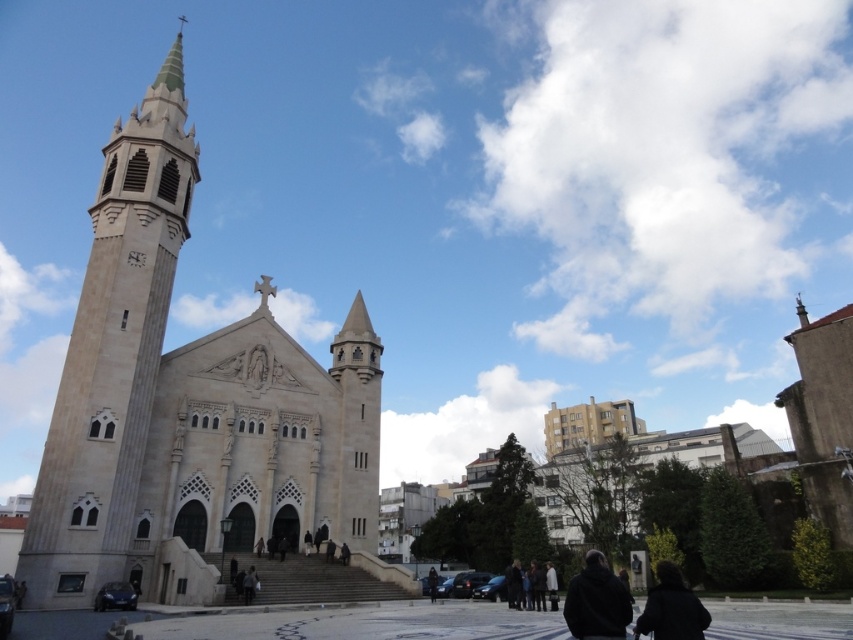
You are a photographer standing in front of the beige stone church at left and the black matte jacket at lower center. Which object would appear closer to you in the photo?

The black matte jacket at lower center would appear closer to you in the photo because it is smaller in size compared to the beige stone church at left, which is larger and likely farther away.

You are standing at the point marked as point (x=39, y=536) in front of the grand church with its tall bell tower. If you want to take a photo of the entire church facade, would your current position allow you to capture the entire structure in one shot without moving? Explain your reasoning based on the distance provided.

The point (x=39, y=536) is 146.78 feet away from the camera. Since the church has a tall bell tower and intricate facade, being 146.78 feet away might be sufficient to capture the entire structure in one shot, but it depends on the camera lens used. A standard lens might require moving closer, while a wide angle could capture it from that distance.